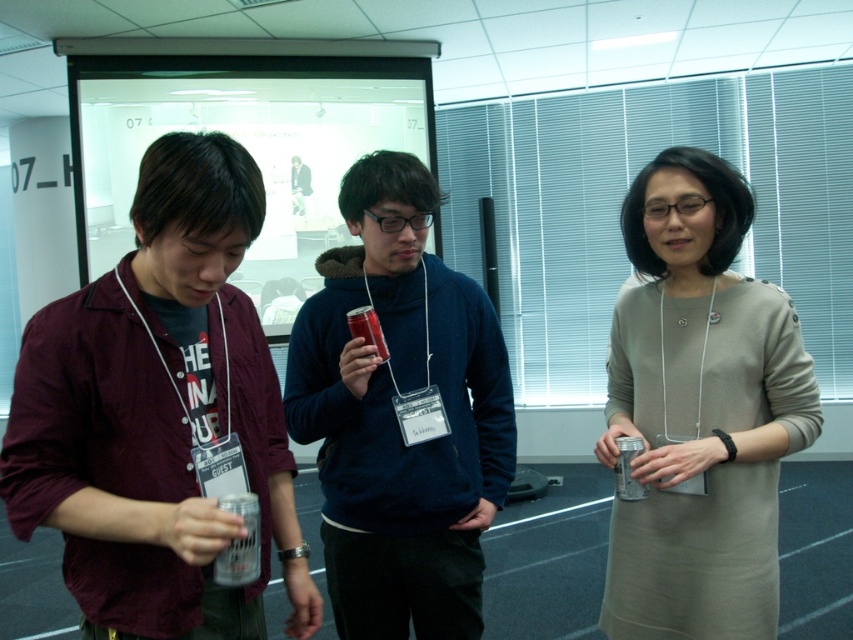
Is maroon shirt at left thinner than matte gray dress at center?

No, maroon shirt at left is not thinner than matte gray dress at center.

Who is lower down, maroon shirt at left or matte gray dress at center?

matte gray dress at center

Does point (207, 630) come farther from viewer compared to point (668, 419)?

No, (207, 630) is closer to viewer.

Find the location of `maroon shirt at left`. maroon shirt at left is located at coordinates pos(158,413).

Can you confirm if maroon shirt at left is taller than matte blue hoodie at center?

No, maroon shirt at left is not taller than matte blue hoodie at center.

Which is more to the left, maroon shirt at left or matte blue hoodie at center?

maroon shirt at left

Is point (132, 440) positioned behind point (408, 632)?

No, (132, 440) is closer to viewer.

Where is `maroon shirt at left`? maroon shirt at left is located at coordinates (158, 413).

Which is in front, point (625, 548) or point (402, 305)?

Point (625, 548) is more forward.

Does matte gray dress at center appear on the left side of matte blue hoodie at center?

In fact, matte gray dress at center is to the right of matte blue hoodie at center.

Identify the location of matte gray dress at center. (699, 412).